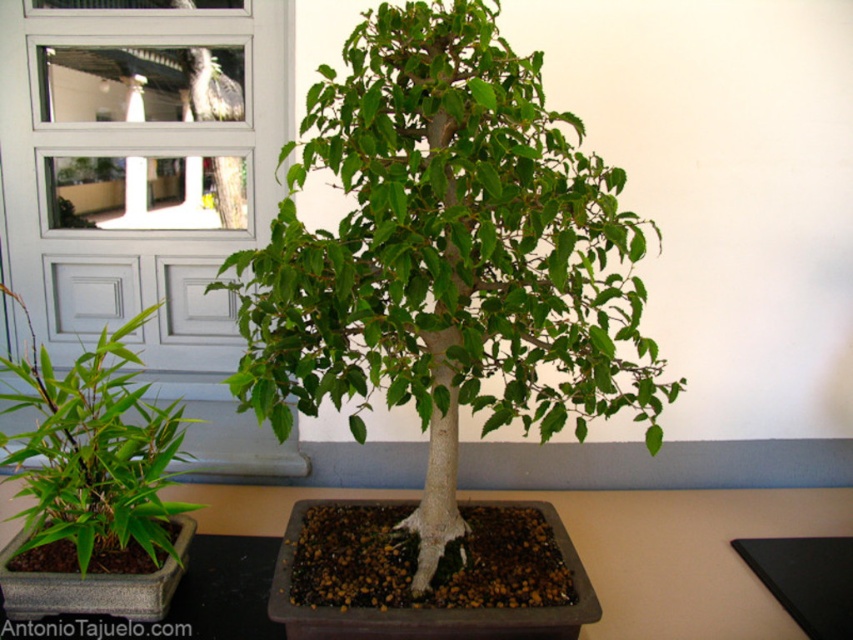
Question: Among these objects, which one is farthest from the camera?

Choices:
 (A) brown matte table at center
 (B) green matte bonsai tree at center

Answer: (A)

Question: Is the position of green matte bonsai tree at center more distant than that of brown matte table at center?

Choices:
 (A) yes
 (B) no

Answer: (B)

Question: Does green matte bonsai tree at center have a larger size compared to brown matte table at center?

Choices:
 (A) yes
 (B) no

Answer: (A)

Question: Is green matte bonsai tree at center below brown matte table at center?

Choices:
 (A) no
 (B) yes

Answer: (A)

Question: Among these points, which one is nearest to the camera?

Choices:
 (A) (403, 404)
 (B) (842, 509)

Answer: (A)